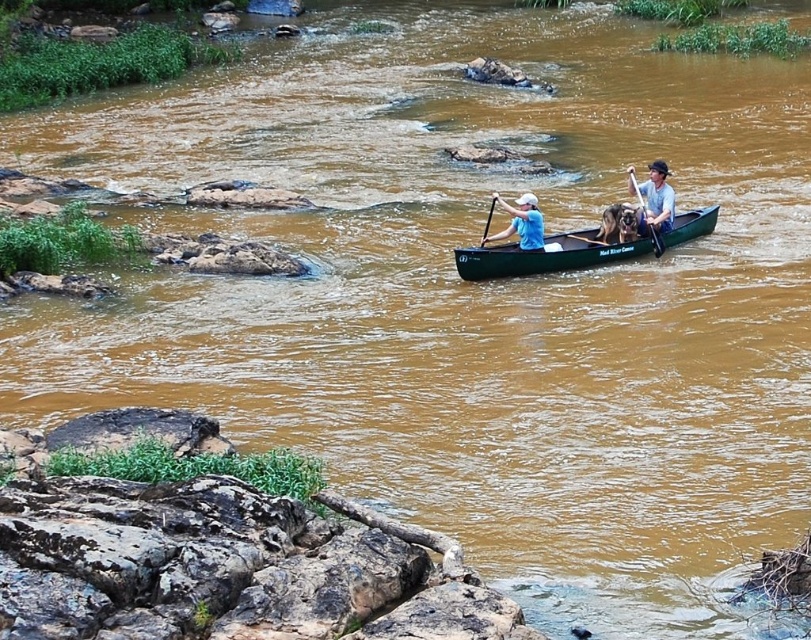
Question: Which point is farther to the camera?

Choices:
 (A) (640, 200)
 (B) (485, 240)

Answer: (A)

Question: In this image, where is green plastic canoe at center located relative to wooden paddle at right?

Choices:
 (A) above
 (B) below

Answer: (B)

Question: Which object is closer to the camera taking this photo?

Choices:
 (A) green plastic canoe at center
 (B) blue fabric shirt at center
 (C) black plastic paddle at center

Answer: (A)

Question: Is wooden paddle at right positioned before black plastic paddle at center?

Choices:
 (A) no
 (B) yes

Answer: (A)

Question: Which of the following is the farthest from the observer?

Choices:
 (A) green plastic canoe at center
 (B) wooden paddle at right
 (C) black plastic paddle at center
 (D) blue fabric shirt at center

Answer: (B)

Question: Is green plastic canoe at center positioned in front of black plastic paddle at center?

Choices:
 (A) no
 (B) yes

Answer: (B)